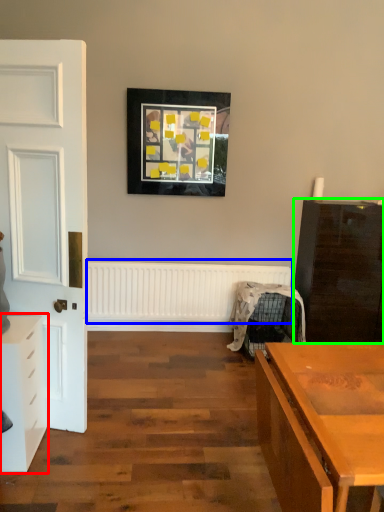
Question: Which object is the closest to the chest of drawers (highlighted by a red box)? Choose among these: radiator (highlighted by a blue box) or chest of drawers (highlighted by a green box).

Choices:
 (A) radiator
 (B) chest of drawers

Answer: (A)